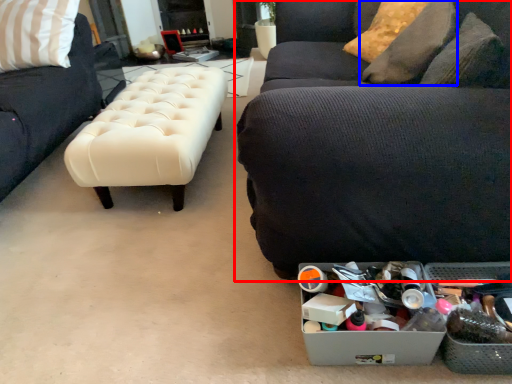
Question: Which object is further to the camera taking this photo, studio couch (highlighted by a red box) or pillow (highlighted by a blue box)?

Choices:
 (A) studio couch
 (B) pillow

Answer: (B)